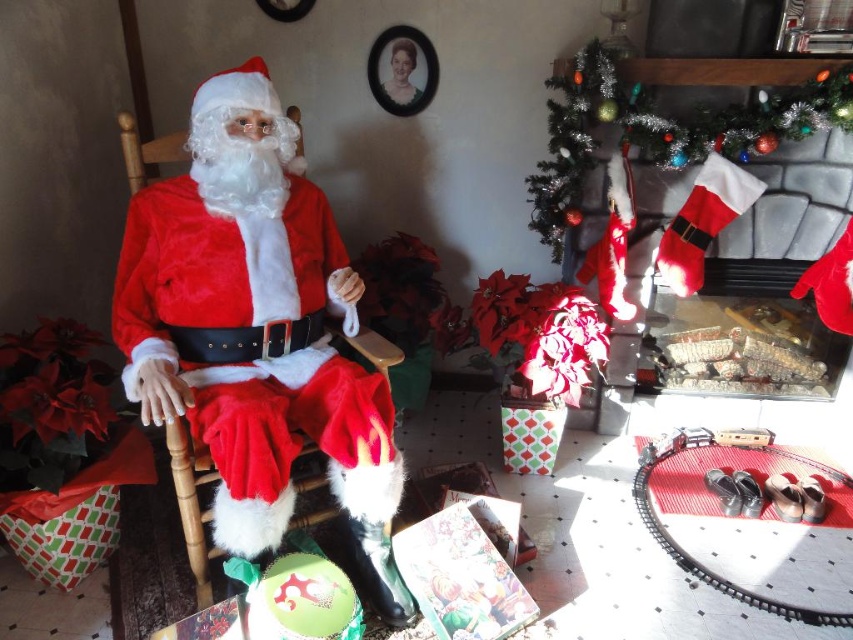
Looking at this image, you are a decorator planning to place a new ornament between the velvet red santa at left and the red velvet stocking at upper right. Based on their widths, which object should you consider moving to make space?

The velvet red santa at left is thinner than the red velvet stocking at upper right, so you should move the red velvet stocking at upper right to make more space since it is wider.

You are a child who is 1.2 meters tall and wants to give Santa a gift. The gift is placed between you and the velvet red santa at left. Can you reach the gift without moving your feet?

The distance between you and the velvet red santa at left is 1.19 meters. Since the gift is placed between you and the velvet red santa at left, the gift is less than 1.19 meters away. As you are 1.2 meters tall, you can likely reach the gift by stretching your arms forward without moving your feet.

You are a child looking for your Christmas gift. You see the velvet red santa at left and the red velvet stocking at upper right. Which object is closer to the fireplace?

The velvet red santa at left is positioned on the left side of the red velvet stocking at upper right, so the red velvet stocking at upper right is closer to the fireplace since it is located to the right of Santa.